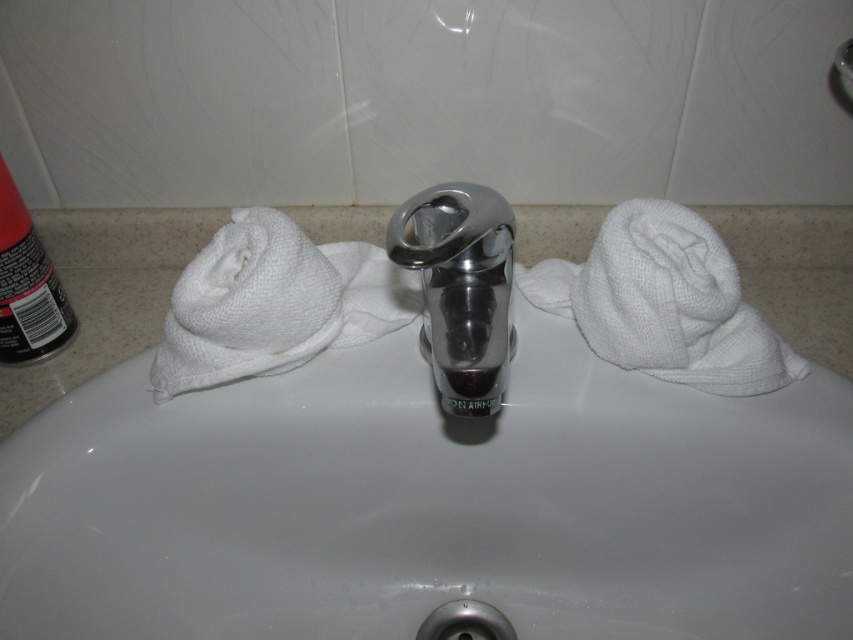
Which of these two, white ceramic sink at center or polished chrome faucet at center, stands shorter?

Standing shorter between the two is polished chrome faucet at center.

Who is more forward, [340,579] or [436,273]?

Positioned in front is point [436,273].

Locate an element on the screen. This screenshot has height=640, width=853. white ceramic sink at center is located at coordinates (436, 461).

Who is positioned more to the right, white ceramic sink at center or black matte can at left?

Positioned to the right is white ceramic sink at center.

Is white ceramic sink at center to the left of black matte can at left from the viewer's perspective?

In fact, white ceramic sink at center is to the right of black matte can at left.

At what (x,y) coordinates should I click in order to perform the action: click on white ceramic sink at center. Please return your answer as a coordinate pair (x, y). Looking at the image, I should click on (436, 461).

Locate an element on the screen. Image resolution: width=853 pixels, height=640 pixels. white ceramic sink at center is located at coordinates (436, 461).

Does white waffle-textured hand towel at right appear over polished chrome faucet at center?

Yes, white waffle-textured hand towel at right is above polished chrome faucet at center.

Based on the photo, can you confirm if white waffle-textured hand towel at right is thinner than polished chrome faucet at center?

Incorrect, white waffle-textured hand towel at right's width is not less than polished chrome faucet at center's.

You are a GUI agent. You are given a task and a screenshot of the screen. Output one action in this format:
    pyautogui.click(x=<x>, y=<y>)
    Task: Click on the white waffle-textured hand towel at right
    
    Given the screenshot: What is the action you would take?
    pyautogui.click(x=665, y=301)

At what (x,y) coordinates should I click in order to perform the action: click on white waffle-textured hand towel at right. Please return your answer as a coordinate pair (x, y). This screenshot has height=640, width=853. Looking at the image, I should click on pyautogui.click(x=665, y=301).